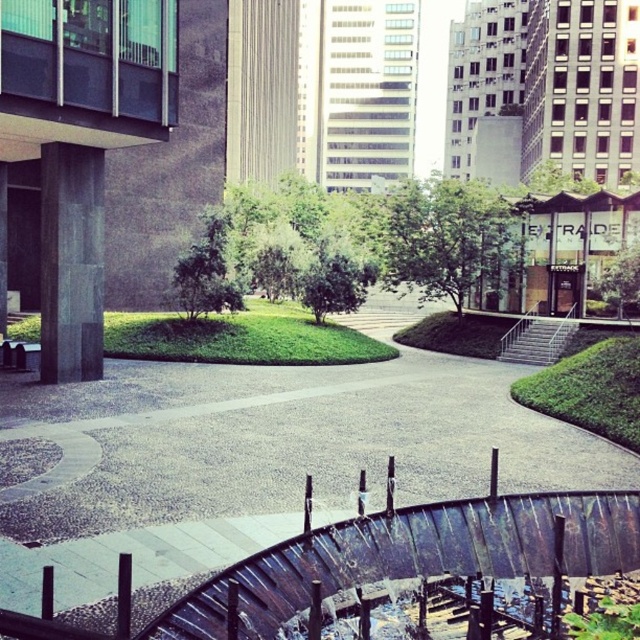
You are walking towards the curved water feature in the urban park. You see the gravel pathway at center and the green leafy tree at center. Which one is closer to you as you approach the water feature?

The gravel pathway at center is in front of the green leafy tree at center, so the gravel pathway at center is closer to you as you approach the water feature.

You are a gardener planning to walk from the edge of the park to the water feature. You have a wheelbarrow that is 1.2 meters wide. The gravel pathway at center and the green leafy tree at center are both along your path. Which path should you choose to ensure your wheelbarrow fits through?

The gravel pathway at center has a larger width than the green leafy tree at center, so you should choose the gravel pathway at center to ensure your wheelbarrow fits through since it is wider than 1.2 meters.